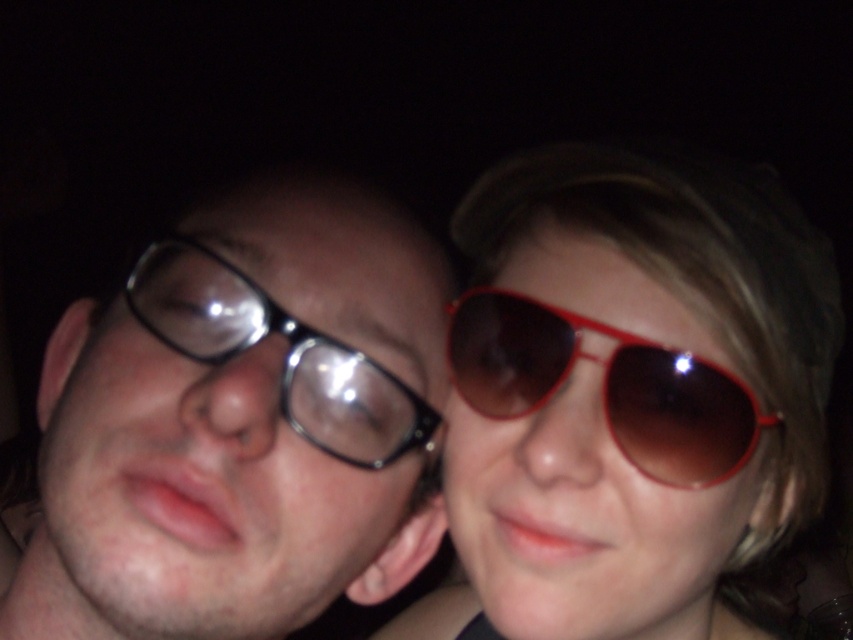
Based on the photo, who is more distant from viewer, (659,364) or (242,308)?

Point (242,308)

Can you confirm if red shiny sunglasses at right is positioned below black plastic glasses at left?

Yes.

Image resolution: width=853 pixels, height=640 pixels. I want to click on red shiny sunglasses at right, so (605, 385).

Where is `red shiny sunglasses at right`? This screenshot has height=640, width=853. red shiny sunglasses at right is located at coordinates (605, 385).

In the scene shown: Can you confirm if matte red sunglasses at upper right is bigger than black plastic glasses at left?

Yes.

Between point (573, 260) and point (194, 276), which one is positioned behind?

Positioned behind is point (573, 260).

Where is `matte red sunglasses at upper right`? The width and height of the screenshot is (853, 640). matte red sunglasses at upper right is located at coordinates (630, 392).

Identify the location of matte red sunglasses at upper right. (630, 392).

How much distance is there between matte black glasses at left and black plastic glasses at left?

matte black glasses at left is 1.82 inches from black plastic glasses at left.

The height and width of the screenshot is (640, 853). In order to click on matte black glasses at left in this screenshot , I will do `click(242, 426)`.

Does point (285, 275) lie in front of point (308, 397)?

No.

At what (x,y) coordinates should I click in order to perform the action: click on matte black glasses at left. Please return your answer as a coordinate pair (x, y). Looking at the image, I should click on (242, 426).